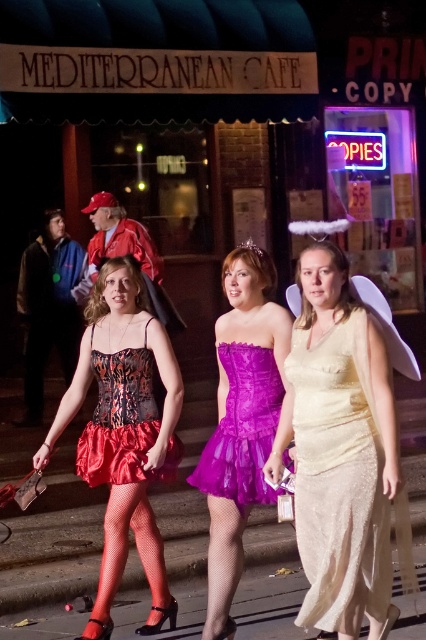
You are a photographer standing in front of the Mediterranean Cafe, and you want to take a photo of both the shiny gold dress at center and the purple satin dress at center. Which dress should you focus on first to ensure both are in clear focus?

You should focus on the shiny gold dress at center first because it is closer to the viewer than the purple satin dress at center, so adjusting focus from near to far will help both be in clear focus.

You are a photographer standing in front of the Mediterranean Cafe at night. You want to take a photo of the shiny red satin skirt at center and the smooth concrete pavement at center. Which object is taller in the photo?

The shiny red satin skirt at center is taller than the smooth concrete pavement at center in the photo.